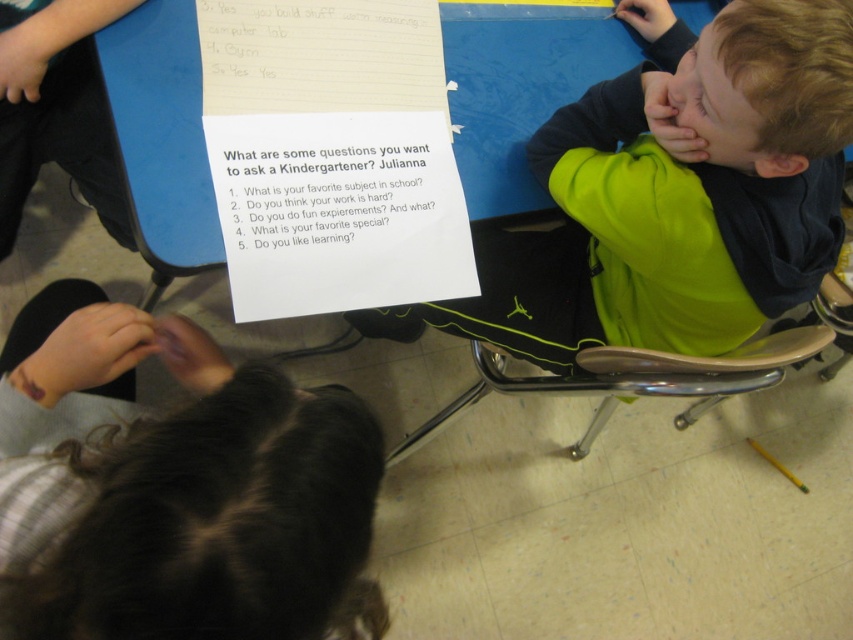
You are a student in the classroom looking at the table with the blue surface and the white sheet of lined paper. There is a point at coordinates (175, 486). Can you tell me what this point corresponds to?

The point at coordinates (175, 486) corresponds to the dark brown hair at lower left.

You are a student sitting at the table with the blue surface and the white lined paper. You want to hand your paper to the teacher who is standing near the neon green hoodie at right. To reach the teacher, do you need to move closer to the dark brown hair at lower left or move away from it?

dark brown hair at lower left is closer to the viewer than neon green hoodie at right, so you need to move away from the dark brown hair at lower left to reach the neon green hoodie at right.